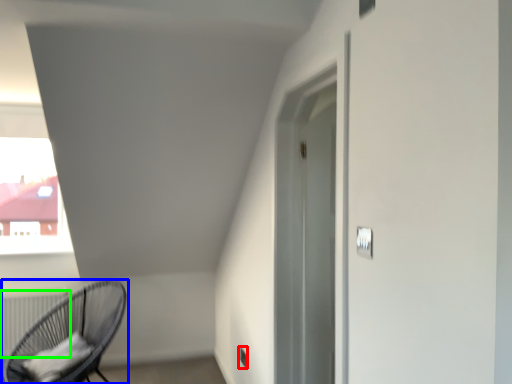
Question: Estimate the real-world distances between objects in this image. Which object is closer to electric outlet (highlighted by a red box), chair (highlighted by a blue box) or radiator (highlighted by a green box)?

Choices:
 (A) chair
 (B) radiator

Answer: (A)